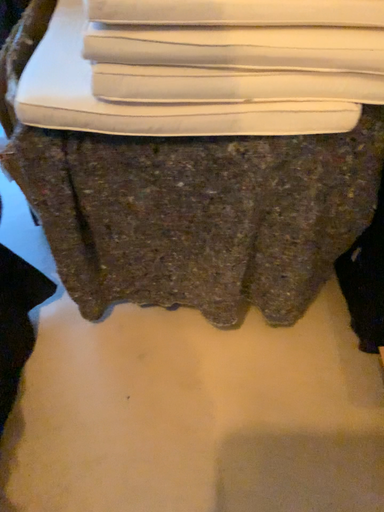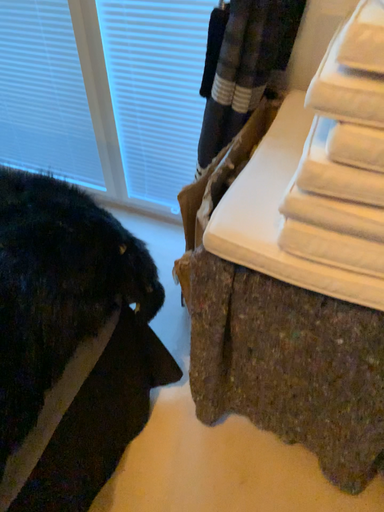
Question: How did the camera likely rotate when shooting the video?

Choices:
 (A) rotated upward
 (B) rotated downward

Answer: (A)